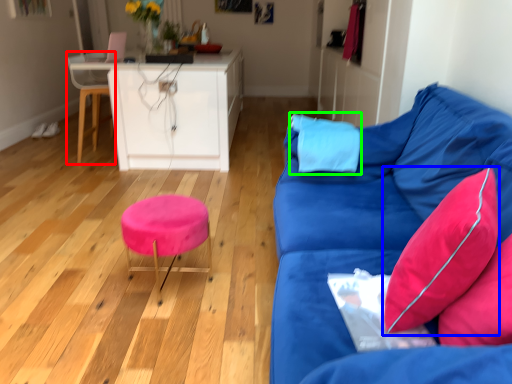
Question: Which object is positioned farthest from swivel chair (highlighted by a red box)? Select from pillow (highlighted by a blue box) and pillow (highlighted by a green box).

Choices:
 (A) pillow
 (B) pillow

Answer: (A)